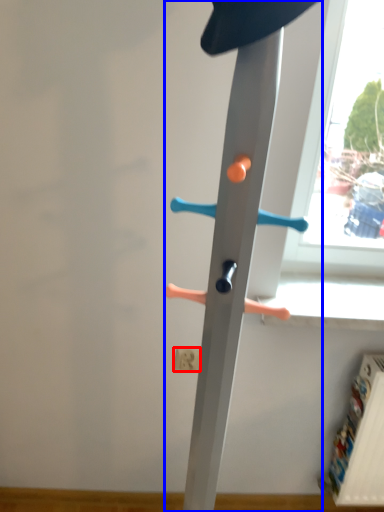
Question: Which object is further to the camera taking this photo, electric outlet (highlighted by a red box) or furniture (highlighted by a blue box)?

Choices:
 (A) electric outlet
 (B) furniture

Answer: (A)